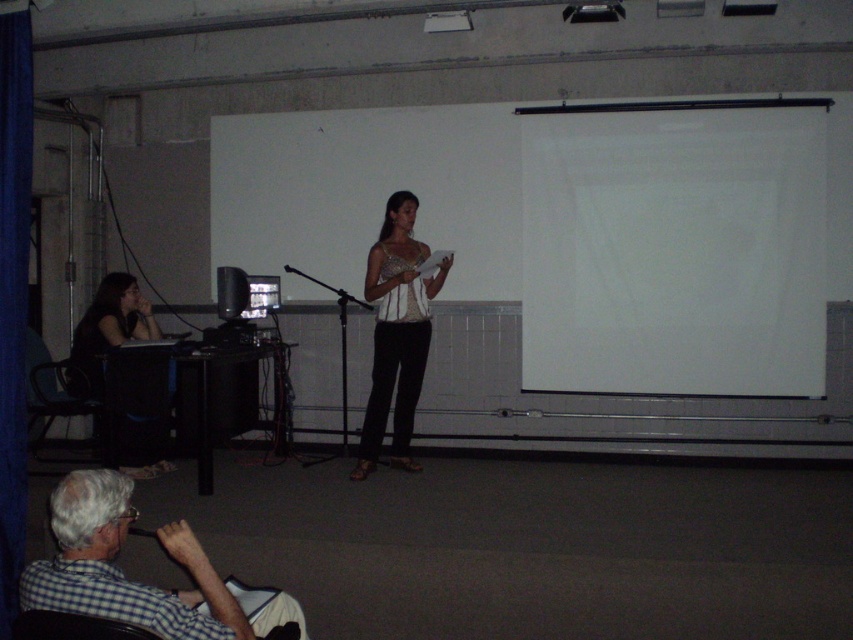
Based on the scene description, can you determine which object is taller between the checkered fabric shirt at lower left and the matte black monitor at left?

The checkered fabric shirt at lower left is much taller than the matte black monitor at left.

Consider the image. Based on the scene description, which object is taller between the black plastic projector at upper center and the black plastic microphone at lower left?

The black plastic microphone at lower left is taller than the black plastic projector at upper center.

You are a stagehand preparing to adjust the lighting for the speaker at the podium. You need to ensure that the checkered fabric shirt at lower left and the matte black monitor at left are both visible to the audience. Based on their positions, which object is closer to the front of the stage?

The checkered fabric shirt at lower left is positioned under the matte black monitor at left, meaning it is closer to the front of the stage.